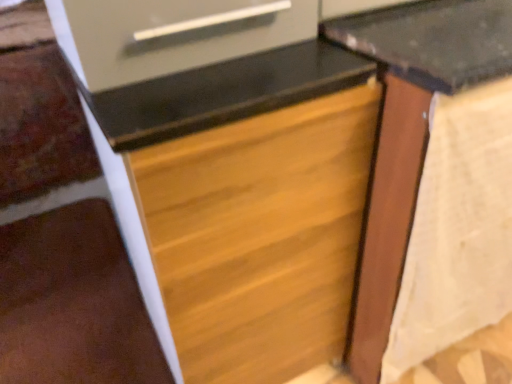
Question: From their relative heights in the image, would you say wooden drawer at center is taller or shorter than brown wood stairwell at lower left?

Choices:
 (A) tall
 (B) short

Answer: (A)

Question: Based on their sizes in the image, would you say wooden drawer at center is bigger or smaller than brown wood stairwell at lower left?

Choices:
 (A) big
 (B) small

Answer: (A)

Question: Based on their relative distances, which object is farther from the wooden drawer at center?

Choices:
 (A) brown wood stairwell at lower left
 (B) wooden table at center

Answer: (A)

Question: Considering the real-world distances, which object is farthest from the brown wood stairwell at lower left?

Choices:
 (A) wooden table at center
 (B) wooden drawer at center

Answer: (A)